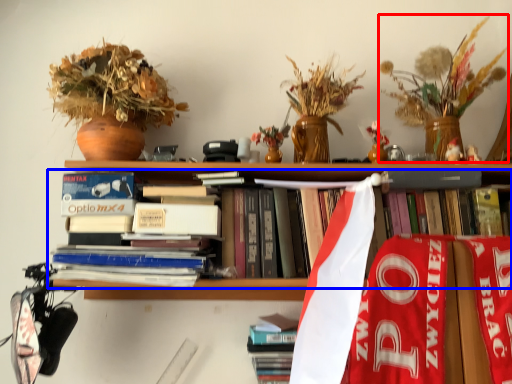
Question: Among these objects, which one is farthest to the camera, floral arrangement (highlighted by a red box) or book (highlighted by a blue box)?

Choices:
 (A) floral arrangement
 (B) book

Answer: (B)